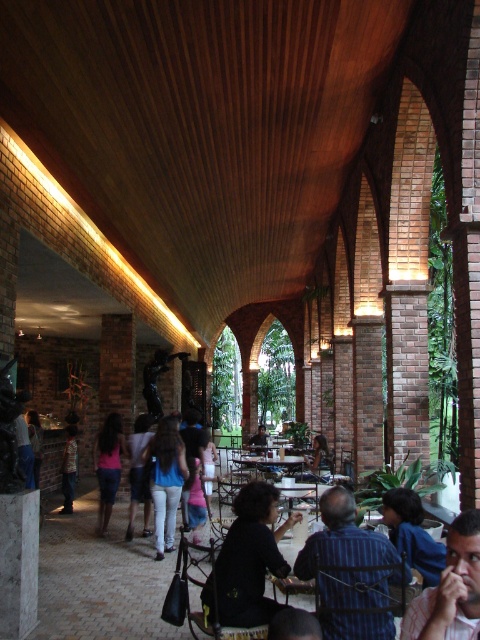
Measure the distance from black matte shirt at center to striped shirt at center.

black matte shirt at center and striped shirt at center are 26.38 feet apart.

Can you confirm if black matte shirt at center is wider than striped shirt at center?

Indeed, black matte shirt at center has a greater width compared to striped shirt at center.

What do you see at coordinates (251, 557) in the screenshot?
I see `black matte shirt at center` at bounding box center [251, 557].

Find the location of a particular element. This screenshot has height=640, width=480. black matte shirt at center is located at coordinates (251, 557).

Is pink fabric dress at center further to camera compared to denim shorts at center?

Yes, pink fabric dress at center is behind denim shorts at center.

Consider the image. Does pink fabric dress at center appear on the left side of denim shorts at center?

Yes, pink fabric dress at center is to the left of denim shorts at center.

Is point (105, 435) positioned in front of point (141, 426)?

Yes, point (105, 435) is closer to viewer.

Locate an element on the screen. This screenshot has width=480, height=640. pink fabric dress at center is located at coordinates (108, 467).

Which is below, blue denim shirt at lower right or striped shirt at center?

Positioned lower is striped shirt at center.

You are a GUI agent. You are given a task and a screenshot of the screen. Output one action in this format:
    pyautogui.click(x=<x>, y=<y>)
    Task: Click on the blue denim shirt at lower right
    The height and width of the screenshot is (640, 480).
    Given the screenshot: What is the action you would take?
    pyautogui.click(x=412, y=532)